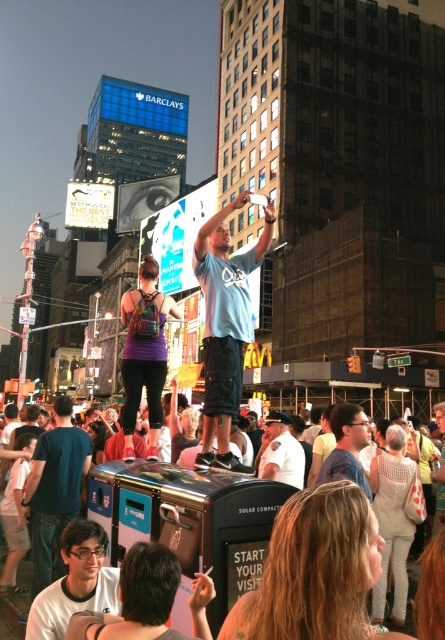
Between matte blue shirt at lower left and white matte t-shirt at lower left, which one appears on the right side from the viewer's perspective?

white matte t-shirt at lower left

Is matte blue shirt at lower left to the right of white matte t-shirt at lower left from the viewer's perspective?

No, matte blue shirt at lower left is not to the right of white matte t-shirt at lower left.

Describe the element at coordinates (55, 490) in the screenshot. I see `matte blue shirt at lower left` at that location.

Find the location of a particular element. The width and height of the screenshot is (445, 640). matte blue shirt at lower left is located at coordinates (55, 490).

Is point (222, 577) closer to camera compared to point (335, 422)?

That is True.

Is metallic trash can at center to the right of matte blue shirt at center from the viewer's perspective?

No, metallic trash can at center is not to the right of matte blue shirt at center.

The height and width of the screenshot is (640, 445). What are the coordinates of `metallic trash can at center` in the screenshot? It's located at (138, 488).

Locate an element on the screen. The height and width of the screenshot is (640, 445). metallic trash can at center is located at coordinates (138, 488).

Between light blue t-shirt at center and metallic trash can at center, which one is positioned lower?

metallic trash can at center

Does light blue t-shirt at center appear over metallic trash can at center?

A: Indeed, light blue t-shirt at center is positioned over metallic trash can at center.

Is point (219, 332) positioned in front of point (28, 566)?

No, (219, 332) is behind (28, 566).

Where is `light blue t-shirt at center`? light blue t-shirt at center is located at coordinates (225, 326).